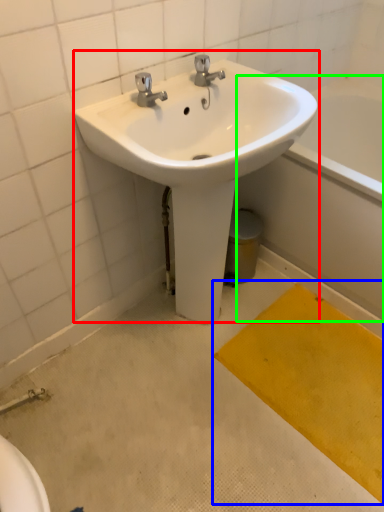
Question: Which object is the closest to the sink (highlighted by a red box)? Choose among these: doormat (highlighted by a blue box) or bath (highlighted by a green box).

Choices:
 (A) doormat
 (B) bath

Answer: (B)